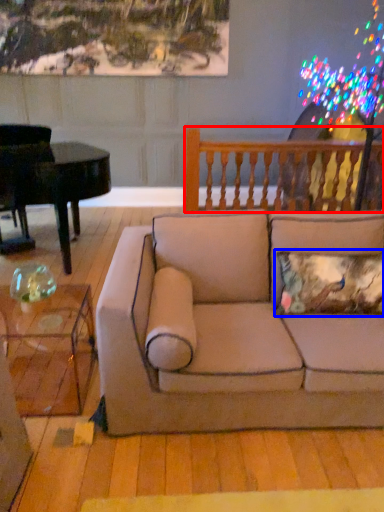
Question: Which of the following is the farthest to the observer, rail (highlighted by a red box) or pillow (highlighted by a blue box)?

Choices:
 (A) rail
 (B) pillow

Answer: (A)